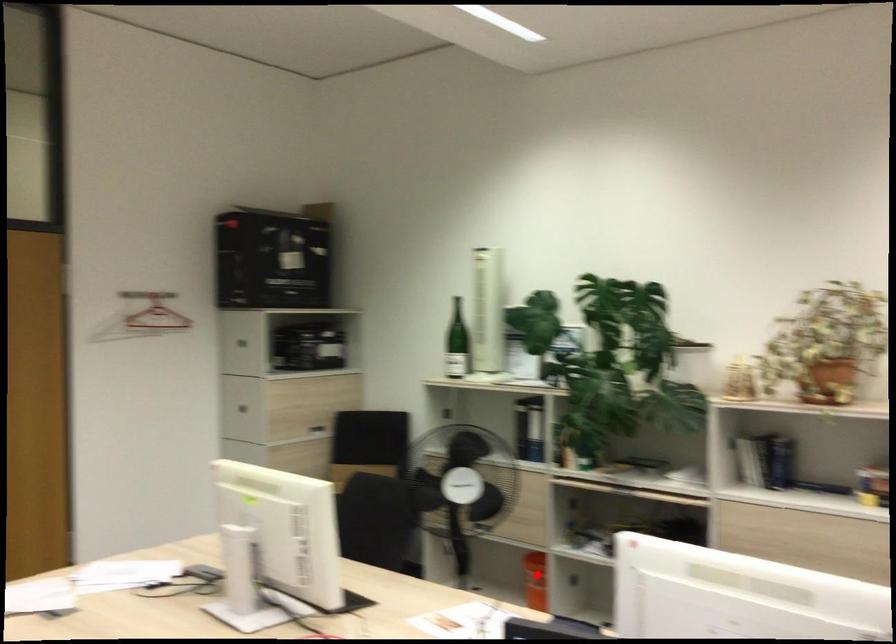
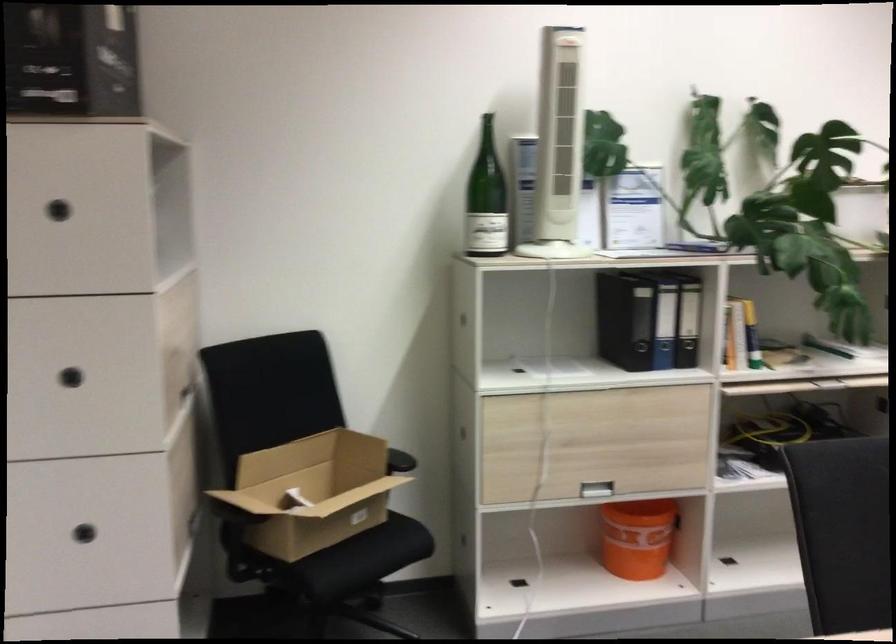
Question: I am providing you with two images of the same scene from different viewpoints. A red point is shown in image1. For the corresponding object point in image2, is it positioned nearer or farther from the camera?

Choices:
 (A) Nearer
 (B) Farther

Answer: (A)